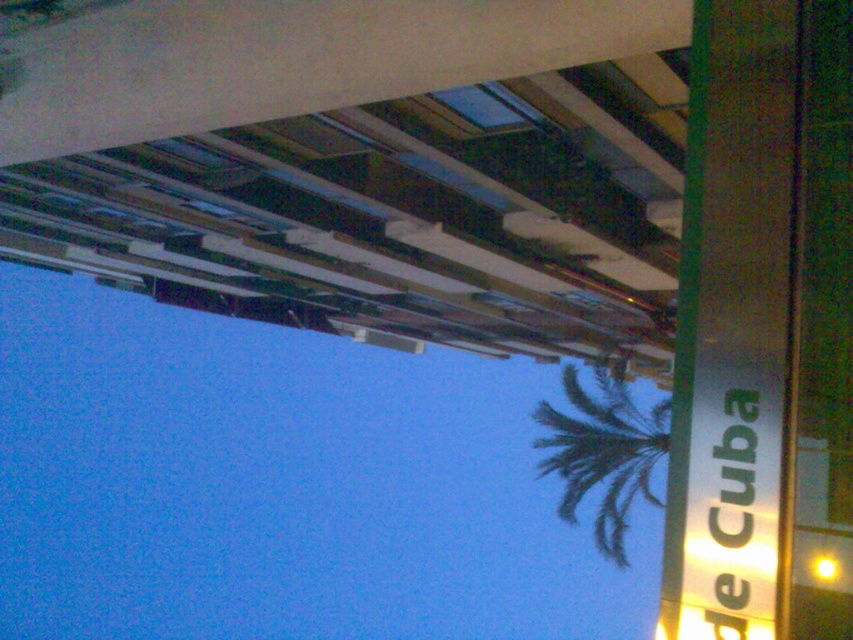
Question: Among these objects, which one is nearest to the camera?

Choices:
 (A) silver metallic sign at right
 (B) green leafy palm tree at center

Answer: (A)

Question: Which of the following is the closest to the observer?

Choices:
 (A) silver metallic sign at right
 (B) green leafy palm tree at center

Answer: (A)

Question: In this image, where is silver metallic sign at right located relative to green leafy palm tree at center?

Choices:
 (A) right
 (B) left

Answer: (B)

Question: Can you confirm if silver metallic sign at right is positioned below green leafy palm tree at center?

Choices:
 (A) yes
 (B) no

Answer: (B)

Question: Is silver metallic sign at right closer to the viewer compared to green leafy palm tree at center?

Choices:
 (A) yes
 (B) no

Answer: (A)